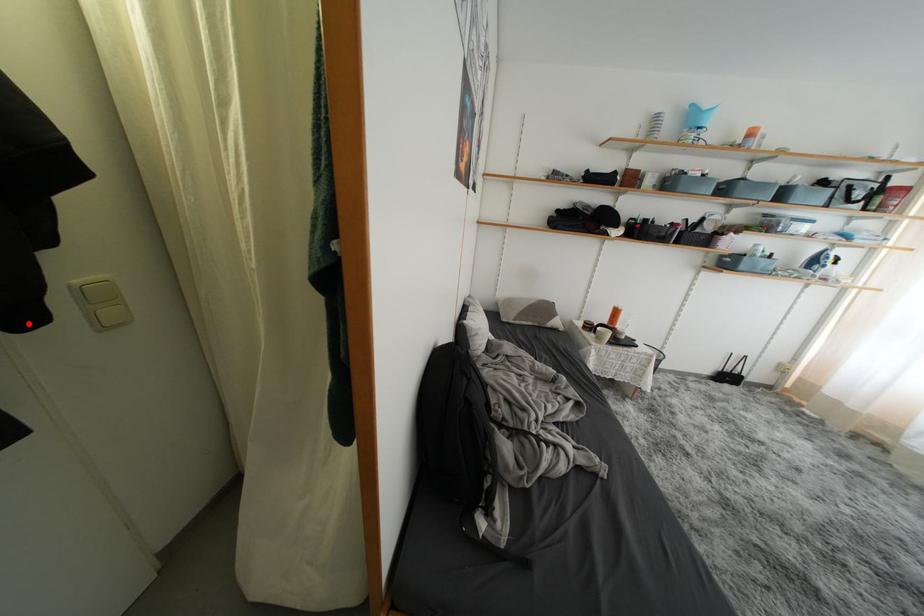
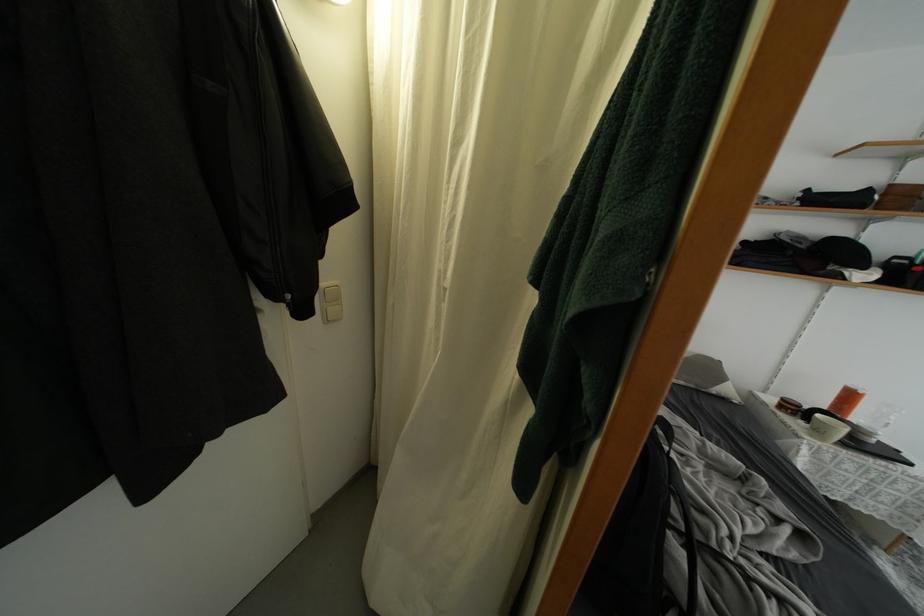
Question: A red point is marked in image1. In image2, is the corresponding 3D point closer to the camera or farther? Reply with the corresponding letter.

Choices:
 (A) The corresponding 3D point is closer.
 (B) The corresponding 3D point is farther.

Answer: (A)